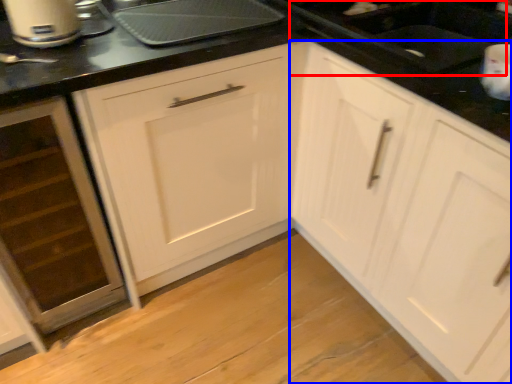
Question: Which of the following is the farthest to the observer, sink (highlighted by a red box) or cabinetry (highlighted by a blue box)?

Choices:
 (A) sink
 (B) cabinetry

Answer: (A)